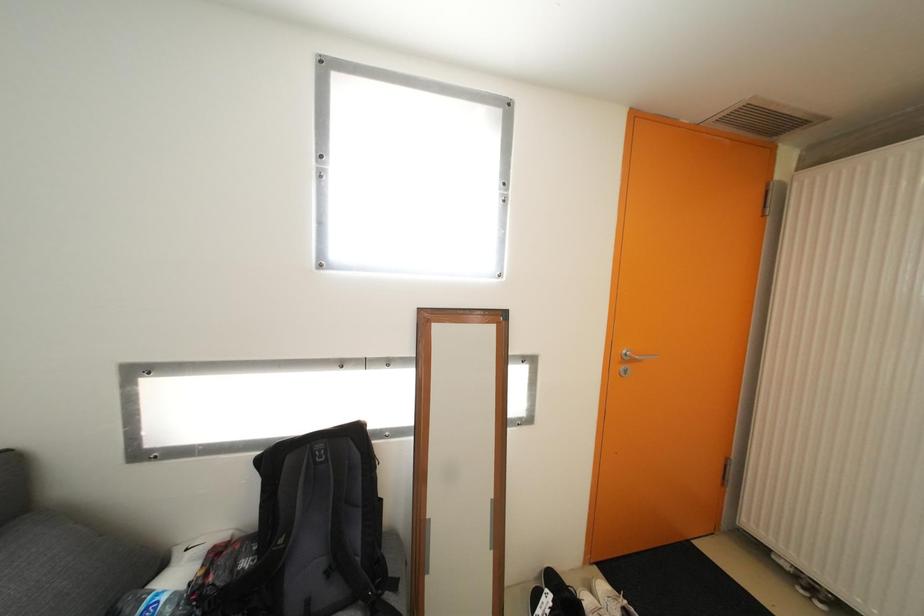
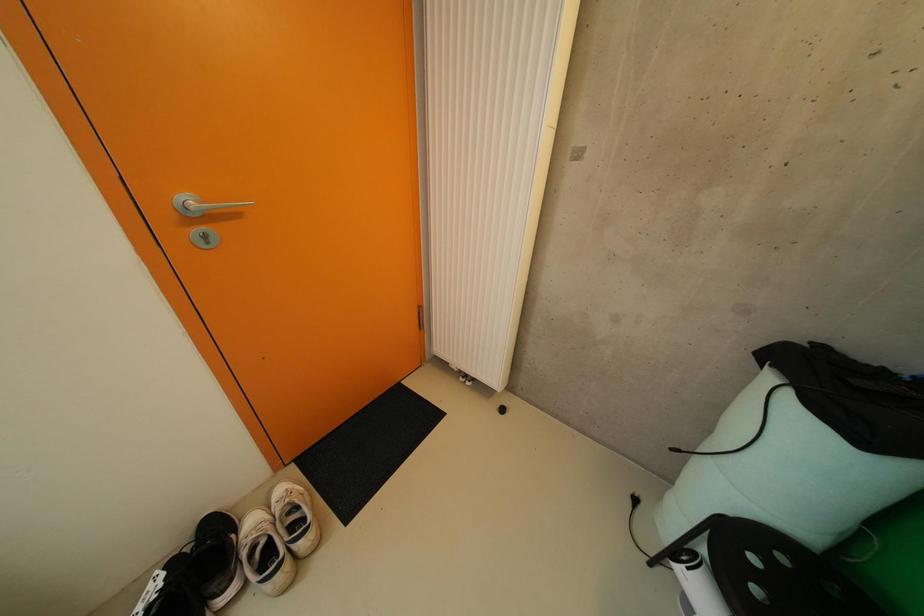
First-person continuous shooting, in which direction is the camera rotating?

The camera's rotation is toward right-down.